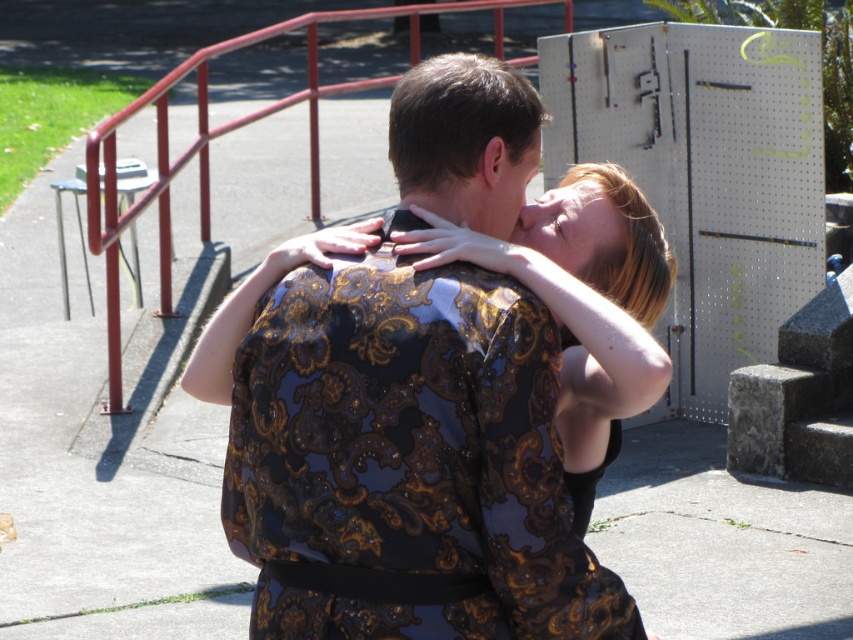
Question: Among these objects, which one is farthest from the camera?

Choices:
 (A) glossy floral-patterned dress at center
 (B) metallic red railing at left

Answer: (B)

Question: Considering the relative positions of glossy floral-patterned dress at center and metallic red railing at left in the image provided, where is glossy floral-patterned dress at center located with respect to metallic red railing at left?

Choices:
 (A) right
 (B) left

Answer: (A)

Question: Can you confirm if glossy floral-patterned dress at center is bigger than metallic red railing at left?

Choices:
 (A) no
 (B) yes

Answer: (A)

Question: Among these points, which one is farthest from the camera?

Choices:
 (A) (495, 33)
 (B) (334, 563)

Answer: (A)

Question: Does glossy floral-patterned dress at center have a lesser width compared to metallic red railing at left?

Choices:
 (A) yes
 (B) no

Answer: (A)